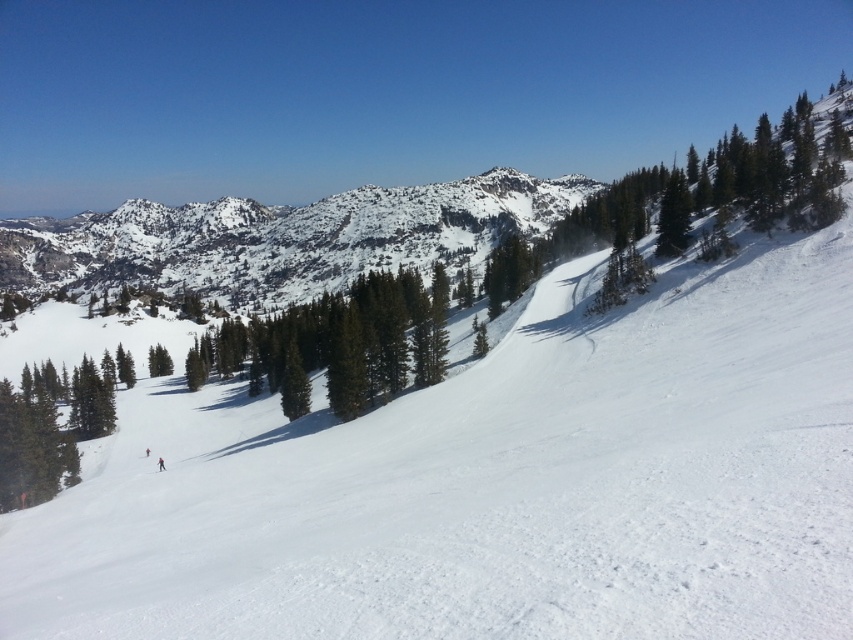
You are a skier who just lost your red matte ski at lower left. You see the green matte tree at center in the distance. Which direction should you look to find your ski?

The green matte tree at center is positioned over the red matte ski at lower left, so you should look towards the lower left direction to find your red matte ski at lower left.